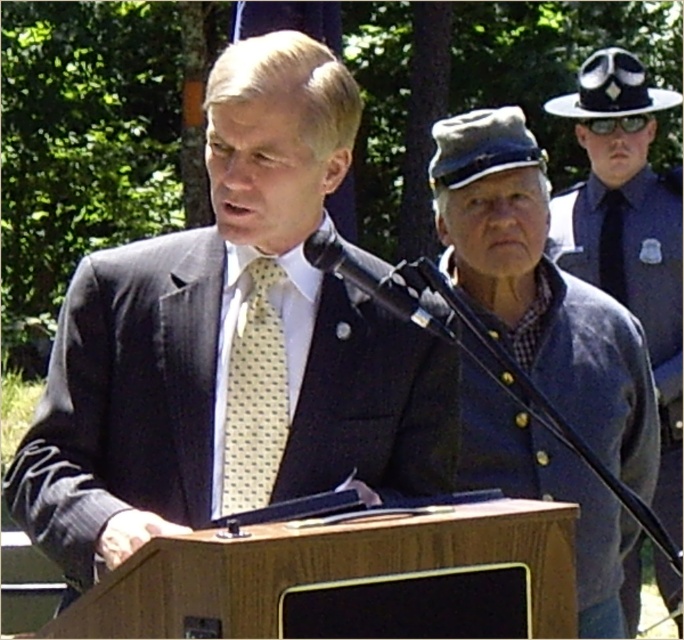
You are attending a formal event and notice a speaker wearing a matte black suit at center and a yellow dotted tie at center. Which item is positioned higher on his body?

The matte black suit at center is located above the yellow dotted tie at center, so the suit is positioned higher on his body.

You are a photographer setting up for an event. You need to ensure that the blue uniformed officer at right and the black plastic microphone at center are both visible in your shot. Given their sizes, which object should you focus on first to frame the shot properly?

The blue uniformed officer at right is taller than the black plastic microphone at center, so you should focus on framing the blue uniformed officer at right first to ensure proper composition.